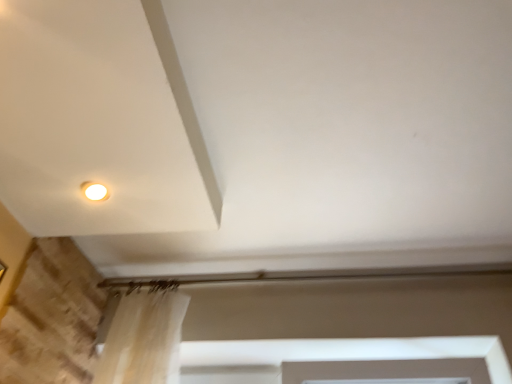
What is the approximate width of white glossy light fixture at upper left?

3.33 inches.

Locate an element on the screen. The image size is (512, 384). white glossy light fixture at upper left is located at coordinates (94, 191).

This screenshot has width=512, height=384. Describe the element at coordinates (94, 191) in the screenshot. I see `white glossy light fixture at upper left` at that location.

Measure the distance between white glossy light fixture at upper left and camera.

1.17 meters.

Locate an element on the screen. The image size is (512, 384). white glossy light fixture at upper left is located at coordinates (94, 191).